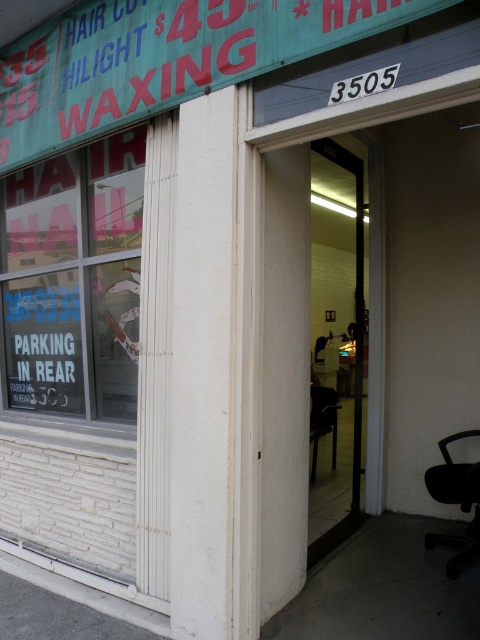
You are a customer arriving at the beauty salon and want to sit down to wait for your appointment. You see a black plastic swivel chair at lower right and a black plastic chair at center. Which chair is closer to the entrance door?

The black plastic swivel chair at lower right is closer to the entrance door because it is in front of the black plastic chair at center.

You are a customer arriving at the beauty salon and see the clear glass window at upper left and the black plastic chair at center. Which object is higher up from the ground?

The clear glass window at upper left is above the black plastic chair at center, so it is higher up from the ground.